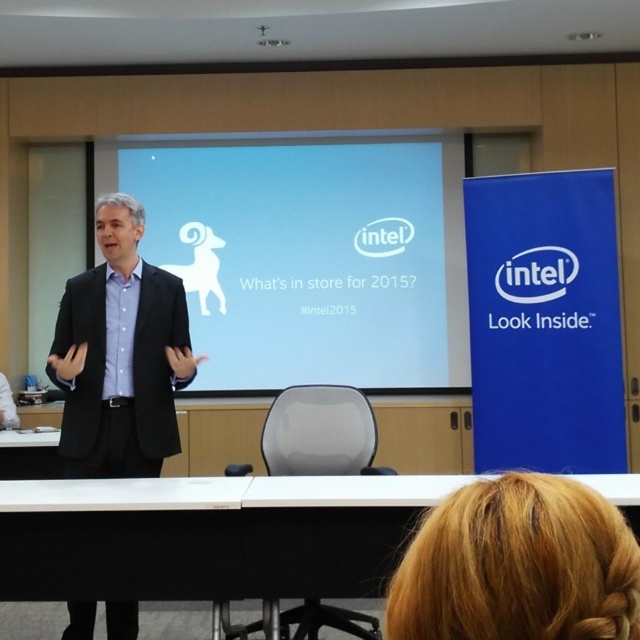
Question: Which object is closer to the camera taking this photo?

Choices:
 (A) white glossy screen at center
 (B) blonde hair at upper right
 (C) black suit at center

Answer: (B)

Question: Considering the relative positions of blonde hair at upper right and black suit at center in the image provided, where is blonde hair at upper right located with respect to black suit at center?

Choices:
 (A) left
 (B) right

Answer: (B)

Question: Among these objects, which one is nearest to the camera?

Choices:
 (A) blonde hair at upper right
 (B) black suit at center

Answer: (A)

Question: Does blonde hair at upper right have a larger size compared to black suit at center?

Choices:
 (A) no
 (B) yes

Answer: (A)

Question: Among these objects, which one is nearest to the camera?

Choices:
 (A) blonde hair at upper right
 (B) black suit at center
 (C) white glossy screen at center

Answer: (A)

Question: Is white glossy screen at center below blonde hair at upper right?

Choices:
 (A) yes
 (B) no

Answer: (B)